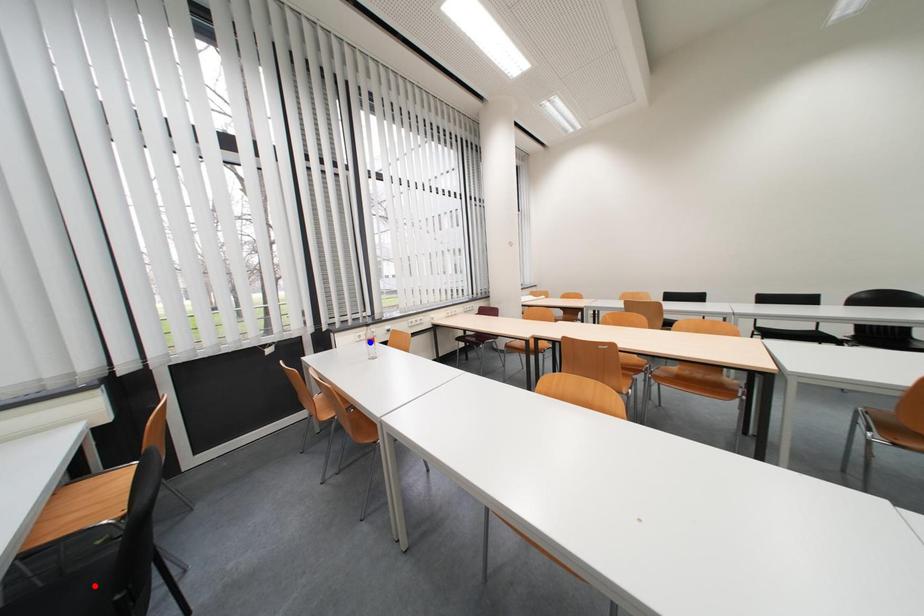
Question: Two points are marked on the image. Which point is closer to the camera?

Choices:
 (A) Blue point is closer.
 (B) Red point is closer.

Answer: (B)